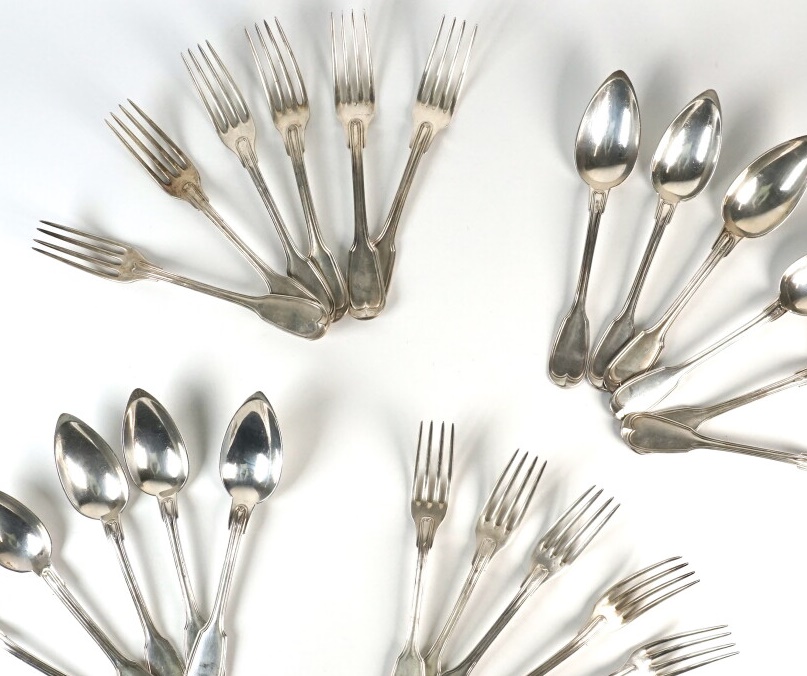
At what (x,y) coordinates should I click in order to perform the action: click on heads of the spoons. Please return your answer as a coordinate pair (x, y). The height and width of the screenshot is (676, 807). Looking at the image, I should click on (34, 544), (81, 477), (153, 448), (243, 456), (595, 139), (676, 139), (751, 193), (804, 293).